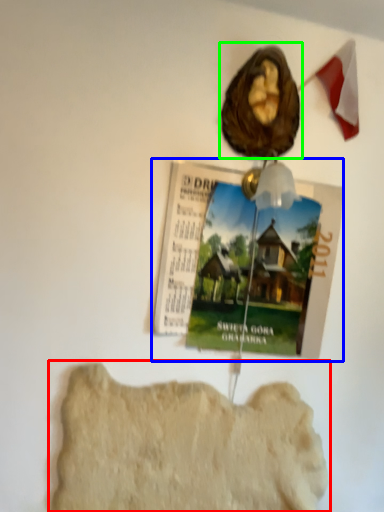
Question: Which is farther away from rock formation (highlighted by a red box)? magazine (highlighted by a blue box) or art (highlighted by a green box)?

Choices:
 (A) magazine
 (B) art

Answer: (B)